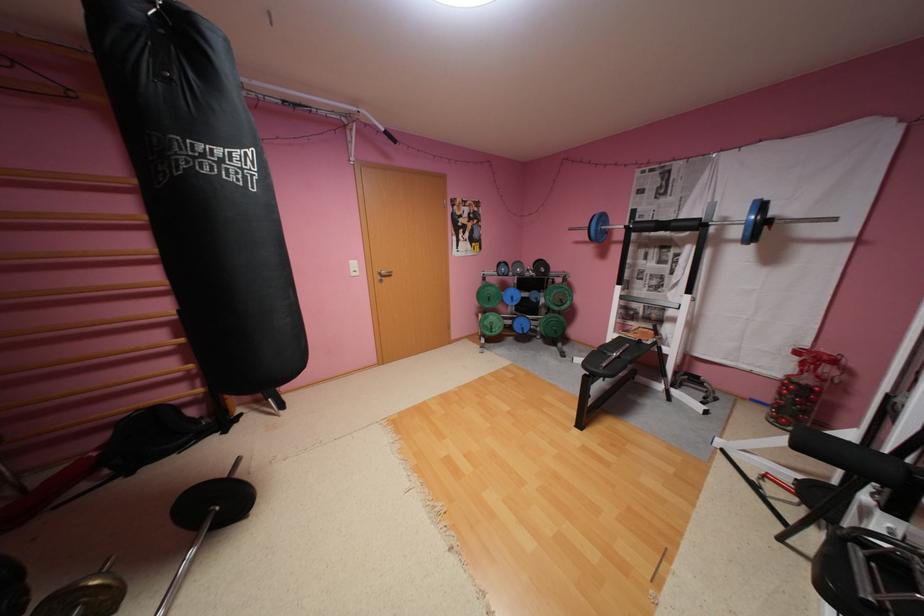
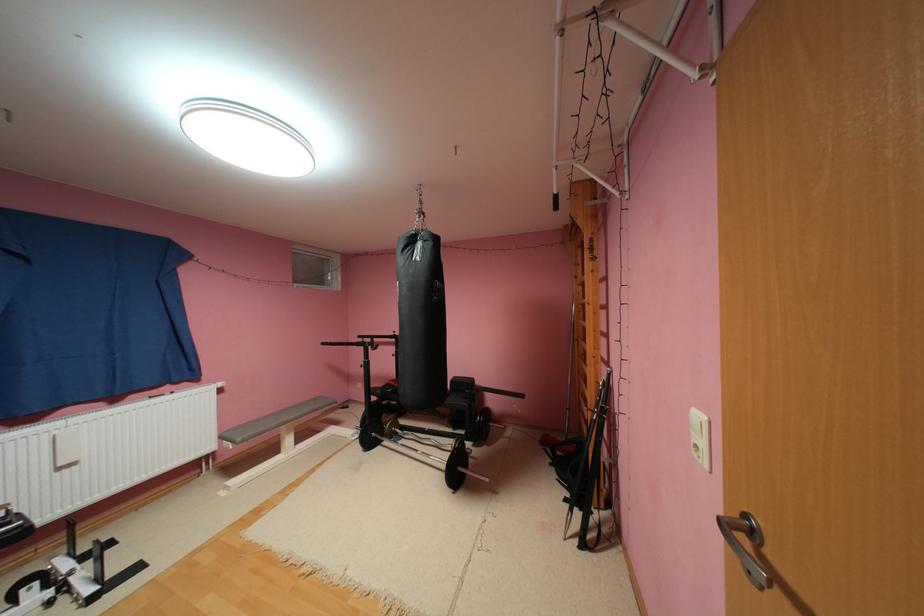
Where in the second image is the point corresponding to (x=235, y=432) from the first image?

(575, 500)